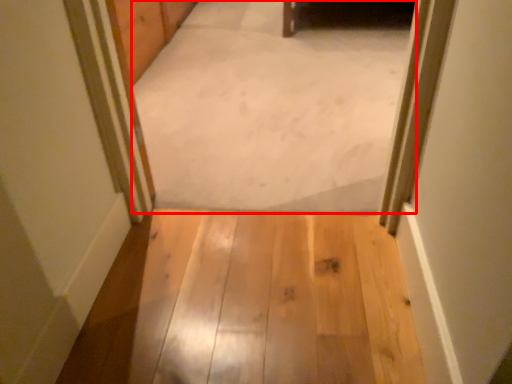
Question: In this image, where is passage (annotated by the red box) located relative to path?

Choices:
 (A) left
 (B) right

Answer: (B)